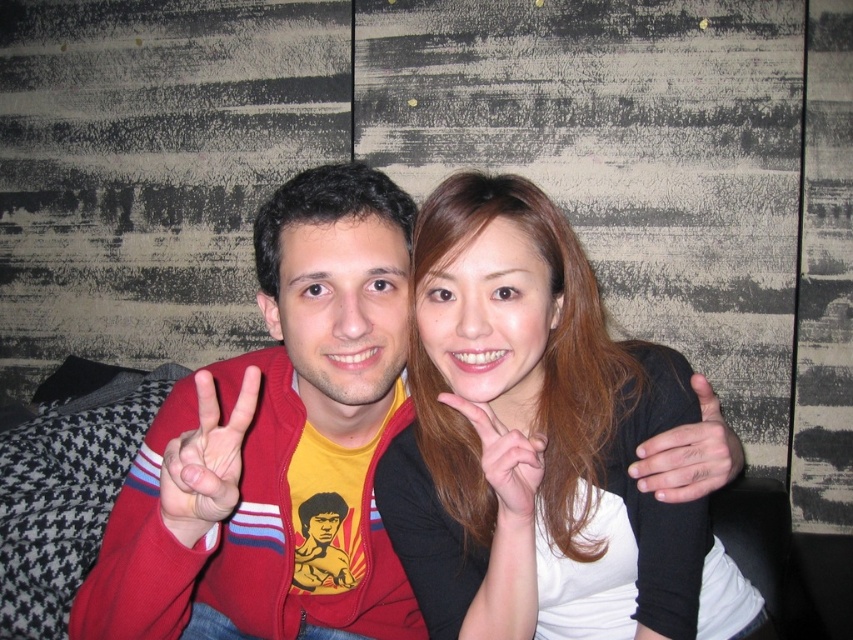
Who is positioned more to the right, matte red sweater at left or smooth skin hand at center?

smooth skin hand at center is more to the right.

Is matte red sweater at left positioned behind smooth skin hand at center?

No, matte red sweater at left is in front of smooth skin hand at center.

Between point (202, 449) and point (662, 452), which one is positioned behind?

Point (662, 452)

You are a GUI agent. You are given a task and a screenshot of the screen. Output one action in this format:
    pyautogui.click(x=<x>, y=<y>)
    Task: Click on the matte red sweater at left
    
    Given the screenshot: What is the action you would take?
    pyautogui.click(x=206, y=460)

Is the position of matte red jacket at center more distant than that of smooth skin hand at center?

No, it is not.

Does matte red jacket at center come in front of smooth skin hand at center?

Yes, it is.

Find the location of `matte red jacket at center`. matte red jacket at center is located at coordinates (277, 442).

Where is `matte red jacket at center`? matte red jacket at center is located at coordinates (277, 442).

Can you confirm if matte red jacket at center is positioned above matte red sweater at left?

No, matte red jacket at center is not above matte red sweater at left.

Does matte red jacket at center have a lesser width compared to matte red sweater at left?

No, matte red jacket at center is not thinner than matte red sweater at left.

The image size is (853, 640). What are the coordinates of `matte red jacket at center` in the screenshot? It's located at (277, 442).